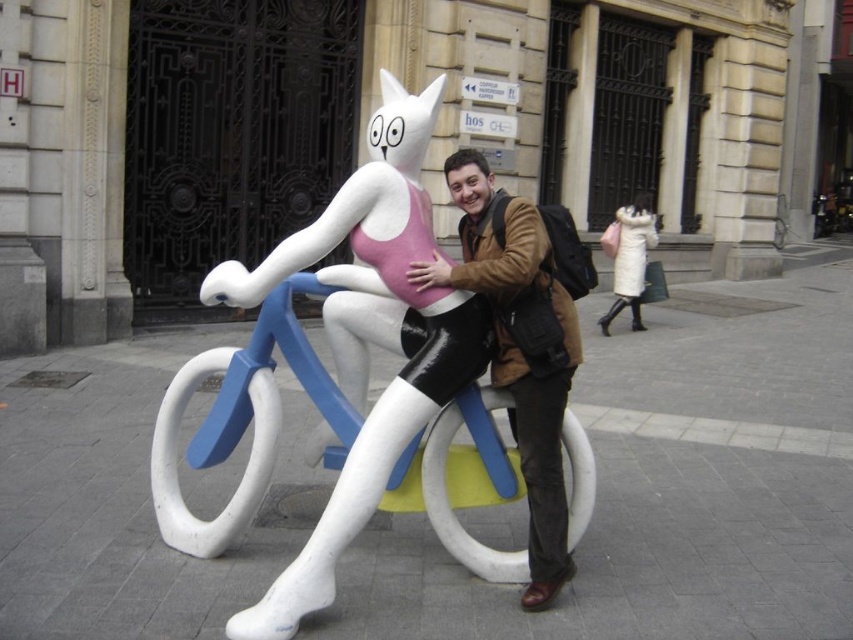
Question: Does white matte cat at center have a greater width compared to white fur coat at upper right?

Choices:
 (A) no
 (B) yes

Answer: (B)

Question: Is brown leather jacket at center to the left of white fur coat at upper right from the viewer's perspective?

Choices:
 (A) no
 (B) yes

Answer: (B)

Question: Which point is farther to the camera?

Choices:
 (A) brown leather jacket at center
 (B) white matte cat at center
 (C) white fur coat at upper right

Answer: (C)

Question: Where is white matte cat at center located in relation to brown leather jacket at center in the image?

Choices:
 (A) below
 (B) above

Answer: (A)

Question: Among these points, which one is nearest to the camera?

Choices:
 (A) (444, 323)
 (B) (647, 221)
 (C) (569, 328)

Answer: (A)

Question: Which point is closer to the camera?

Choices:
 (A) (564, 538)
 (B) (500, 356)
 (C) (605, 336)

Answer: (A)